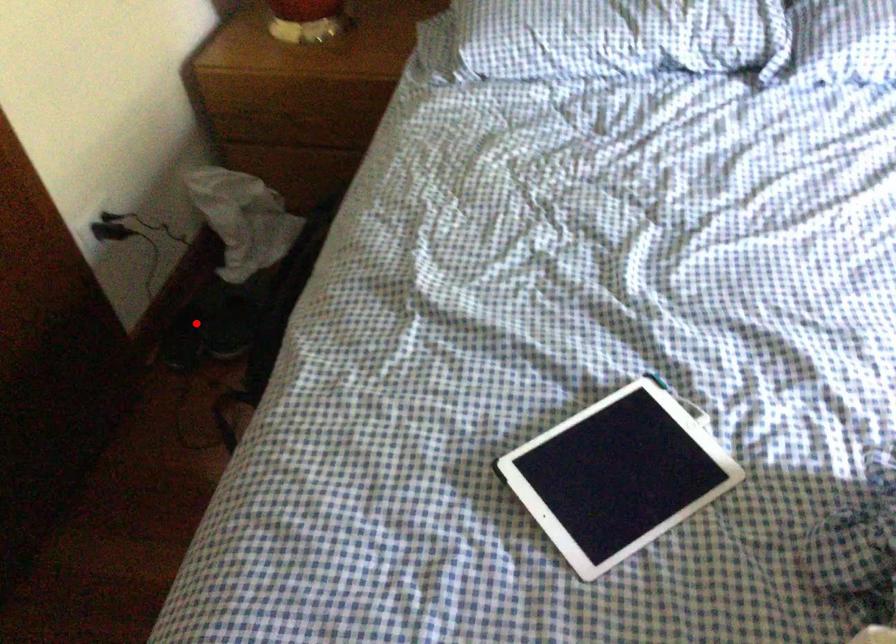
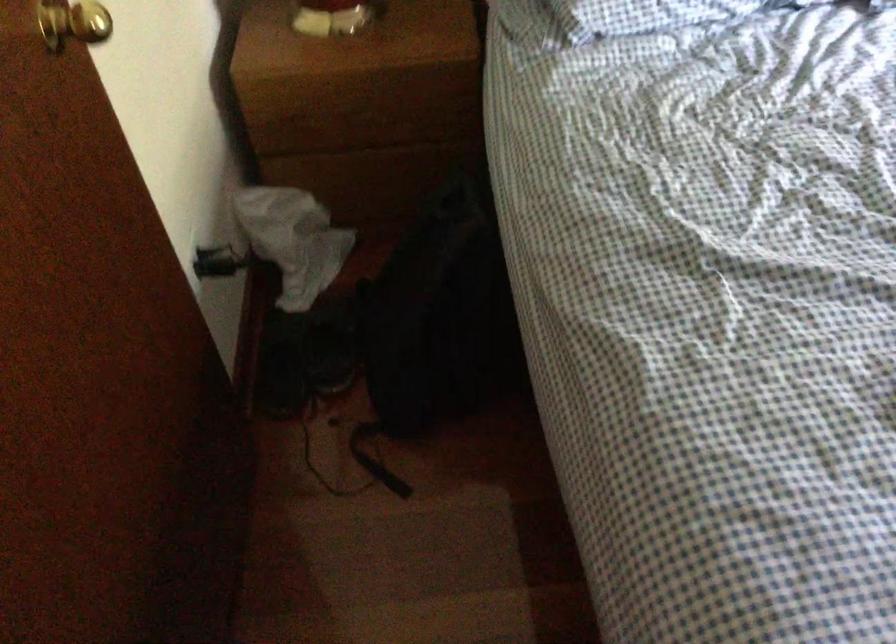
Question: I am providing you with two images of the same scene from different viewpoints. A red point is marked on the first image. At the location where the point appears in image 1, is it still visible in image 2?

Choices:
 (A) Yes
 (B) No

Answer: (A)